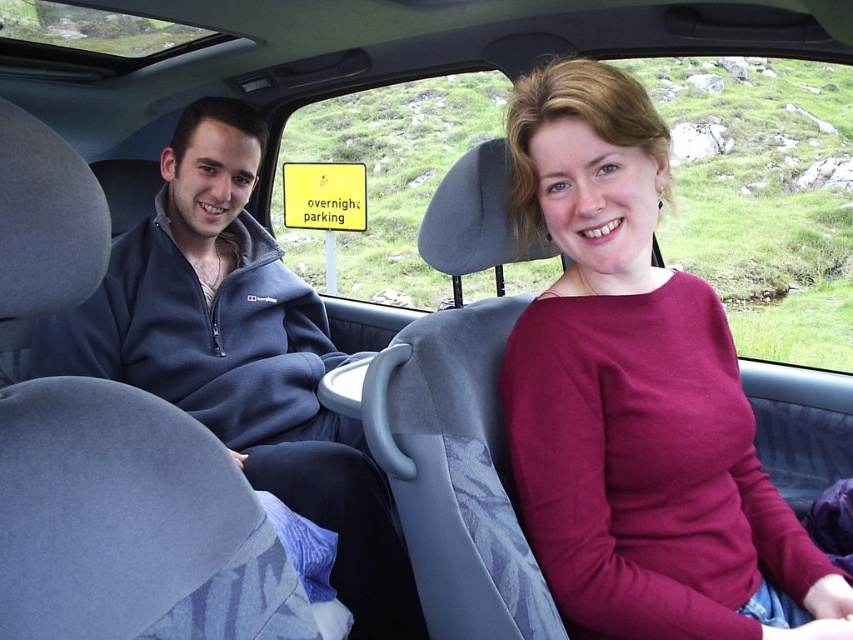
Is maroon sweater at center to the left of dark blue fleece at left from the viewer's perspective?

In fact, maroon sweater at center is to the right of dark blue fleece at left.

How far apart are maroon sweater at center and dark blue fleece at left?

maroon sweater at center and dark blue fleece at left are 86.74 centimeters apart.

What are the coordinates of `maroon sweater at center` in the screenshot? It's located at (637, 397).